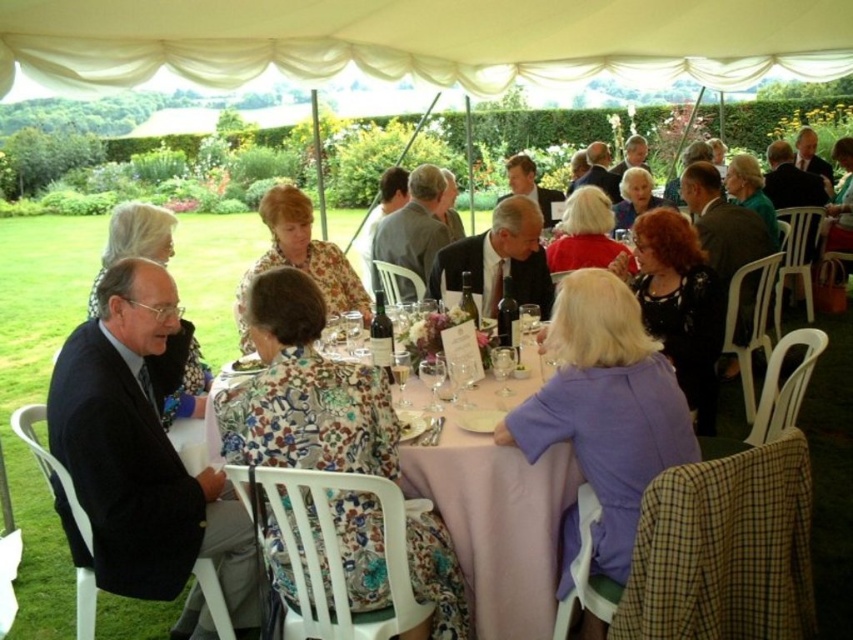
Question: Which point is closer to the camera?

Choices:
 (A) floral fabric dress at center
 (B) transparent glass wine glass at table center
 (C) white fabric canopy at upper center
 (D) green leafy salad at center

Answer: (B)

Question: Does white fabric canopy at upper center have a smaller size compared to dark blue suit at left?

Choices:
 (A) no
 (B) yes

Answer: (B)

Question: Can you confirm if matte black suit at center is positioned below matte black suit at left?

Choices:
 (A) yes
 (B) no

Answer: (B)

Question: Is white fabric canopy at upper center thinner than floral fabric dress at center?

Choices:
 (A) yes
 (B) no

Answer: (A)

Question: Which of the following is the closest to the observer?

Choices:
 (A) (512, 269)
 (B) (250, 356)
 (C) (566, 38)
 (D) (495, 365)

Answer: (D)

Question: Which point appears closest to the camera in this image?

Choices:
 (A) (256, 625)
 (B) (424, 380)
 (C) (544, 282)
 (D) (496, 371)

Answer: (B)